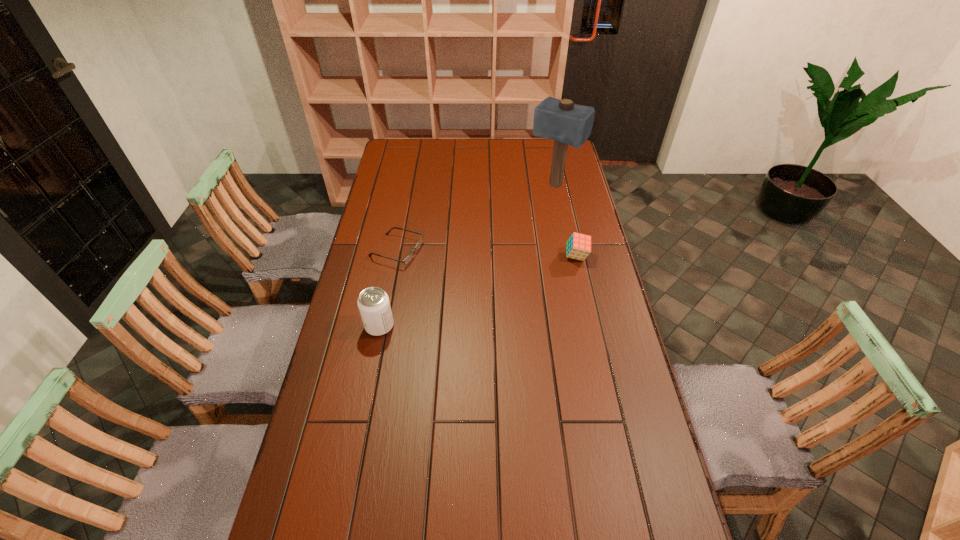
Locate an element on the screen. This screenshot has height=540, width=960. vacant spot on the desktop that is between the soda can and the cube and is positioned on the front-facing side of the spectacles is located at coordinates (507, 281).

Image resolution: width=960 pixels, height=540 pixels. Find the location of `free spot on the desktop that is between the soda can and the cube and is positioned on the striking surface of the mallet`. free spot on the desktop that is between the soda can and the cube and is positioned on the striking surface of the mallet is located at coordinates (458, 299).